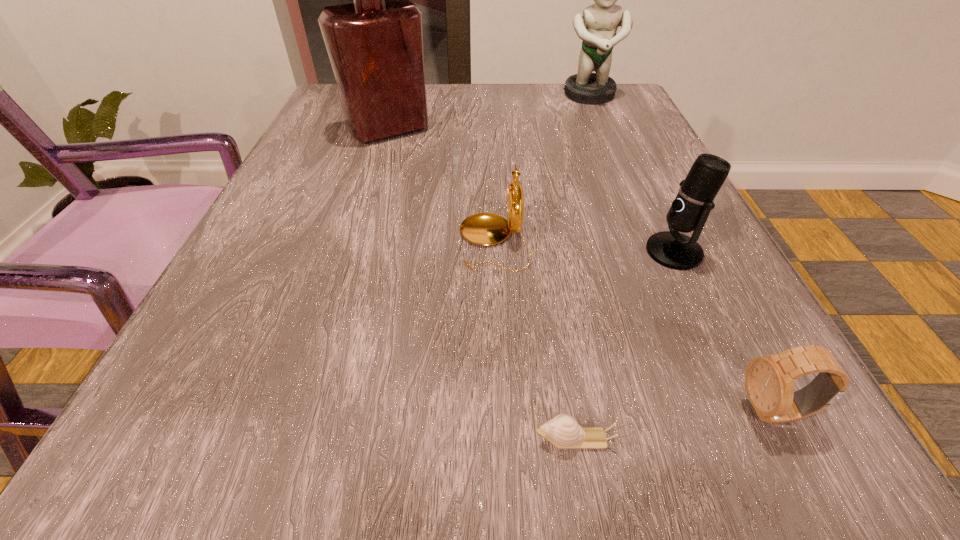
Identify the location of free space between the pocket watch and the watch. (634, 327).

Find the location of a particular element. This screenshot has width=960, height=540. vacant area that lies between the leftmost object and the microphone is located at coordinates (531, 191).

The height and width of the screenshot is (540, 960). In order to click on free spot between the tallest object and the third tallest object in this screenshot , I will do click(x=531, y=191).

Locate an element on the screen. Image resolution: width=960 pixels, height=540 pixels. vacant space that's between the microphone and the leftmost object is located at coordinates (531, 191).

Find the location of a particular element. The width and height of the screenshot is (960, 540). unoccupied position between the shortest object and the watch is located at coordinates (675, 426).

You are a GUI agent. You are given a task and a screenshot of the screen. Output one action in this format:
    pyautogui.click(x=<x>, y=<y>)
    Task: Click on the free space between the third tallest object and the pocket watch
    The image size is (960, 540).
    Given the screenshot: What is the action you would take?
    pyautogui.click(x=584, y=247)

Identify the location of vacant area that lies between the second farthest object and the second tallest object. (489, 113).

Identify the location of the closest object relative to the tallest object. The image size is (960, 540). tap(485, 229).

Locate an element on the screen. Image resolution: width=960 pixels, height=540 pixels. the second closest object to the escargot is located at coordinates (485, 229).

Image resolution: width=960 pixels, height=540 pixels. What are the coordinates of `free space that satisfies the following two spatial constraints: 1. on the face of the pocket watch; 2. on the left side of the fourth shortest object` in the screenshot? It's located at (494, 252).